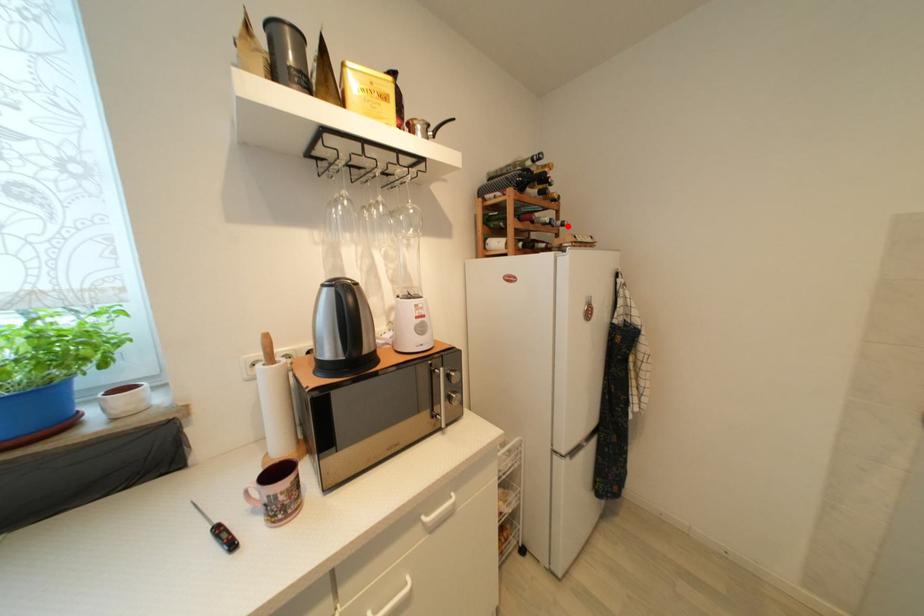
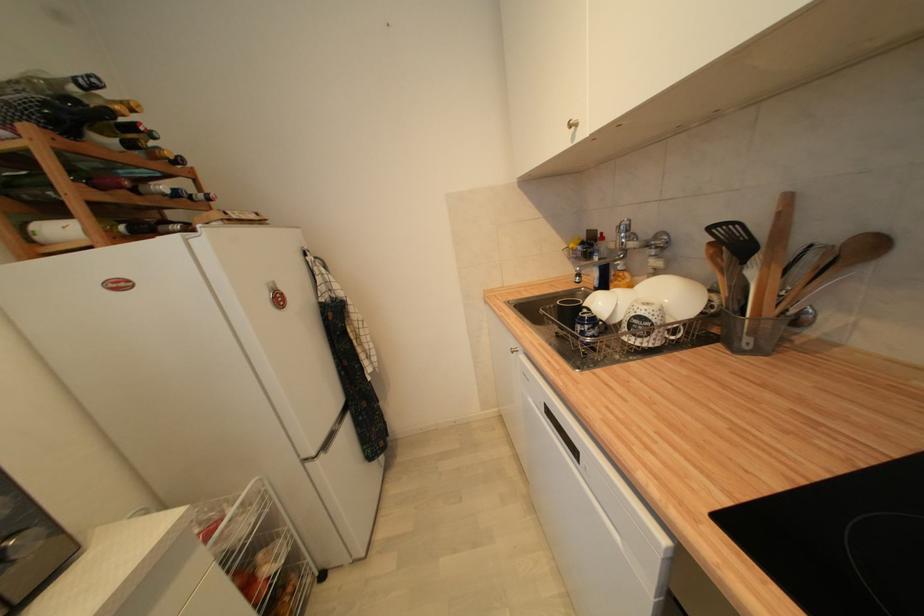
Locate, in the second image, the point that corresponds to the highlighted location in the first image.

(213, 200)